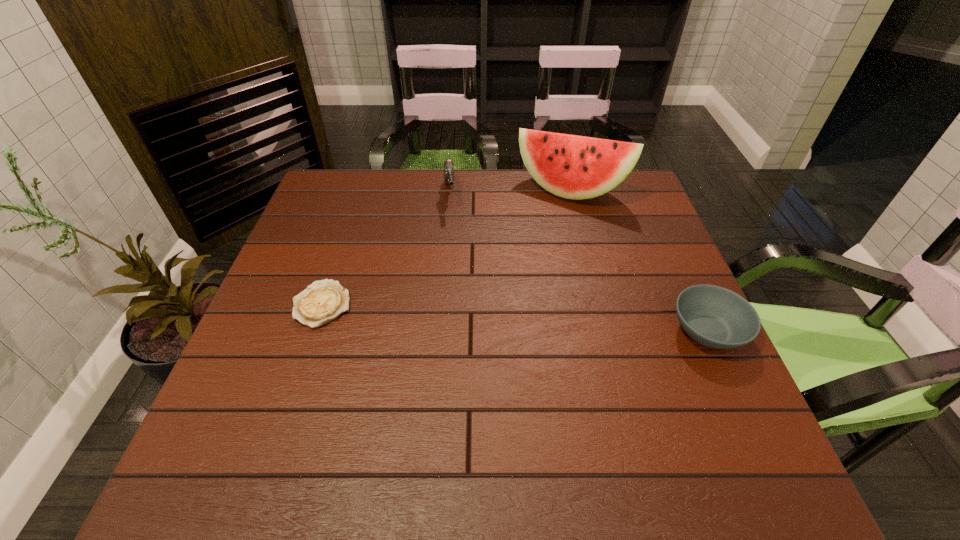
The width and height of the screenshot is (960, 540). In the image, there is a desktop. Find the location of `vacant space at the far edge`. vacant space at the far edge is located at coordinates (561, 206).

The width and height of the screenshot is (960, 540). In the image, there is a desktop. What are the coordinates of `free space at the near edge` in the screenshot? It's located at (539, 429).

In order to click on free space at the left edge of the desktop in this screenshot , I will do `click(315, 268)`.

What are the coordinates of `vacant space at the right edge of the desktop` in the screenshot? It's located at (620, 228).

Identify the location of free space at the near left corner of the desktop. The width and height of the screenshot is (960, 540). (274, 402).

Where is `free spot at the far right corner of the desktop`? The image size is (960, 540). free spot at the far right corner of the desktop is located at coordinates (639, 188).

Image resolution: width=960 pixels, height=540 pixels. Identify the location of free space that is in between the leftmost object and the second object from left to right. (386, 249).

The width and height of the screenshot is (960, 540). In order to click on vacant space in between the third shortest object and the soup bowl in this screenshot , I will do `click(579, 263)`.

The width and height of the screenshot is (960, 540). I want to click on vacant point located between the quiche and the soup bowl, so click(x=515, y=318).

Find the location of a particular element. vacant space that is in between the tallest object and the soup bowl is located at coordinates (639, 261).